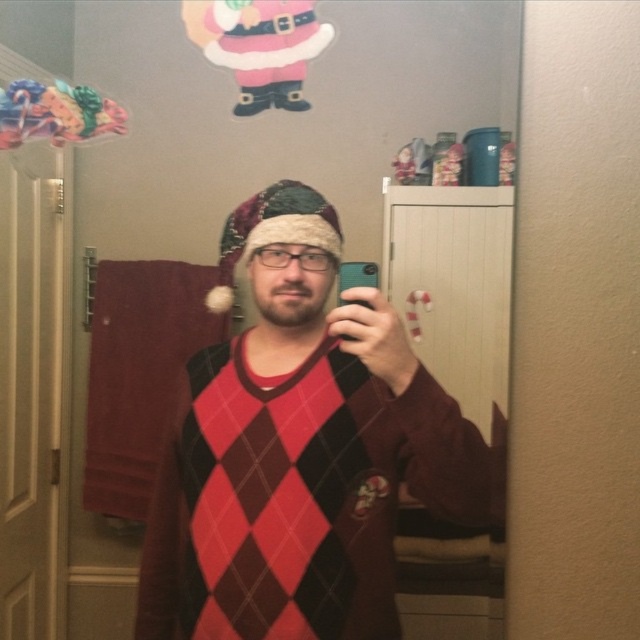
Can you confirm if fuzzy fabric santa hat at center is wider than black plastic phone at center?

Indeed, fuzzy fabric santa hat at center has a greater width compared to black plastic phone at center.

Between fuzzy fabric santa hat at center and black plastic phone at center, which one appears on the left side from the viewer's perspective?

Positioned to the left is fuzzy fabric santa hat at center.

Is point (268, 186) closer to viewer compared to point (372, 275)?

No, (268, 186) is further to viewer.

This screenshot has height=640, width=640. I want to click on fuzzy fabric santa hat at center, so click(273, 230).